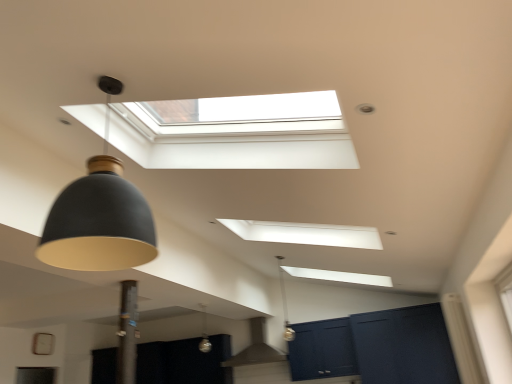
Question: Is point (397, 369) positioned closer to the camera than point (202, 326)?

Choices:
 (A) farther
 (B) closer

Answer: (B)

Question: Do you think matte dark blue cabinet at lower right is within satin silver glass at center, acting as the third lamp starting from the top, or outside of it?

Choices:
 (A) outside
 (B) inside

Answer: (A)

Question: Estimate the real-world distances between objects in this image. Which object is closer to the matte black pendant light at center, which is counted as the second lamp, starting from the top?

Choices:
 (A) matte gray exhaust hood at center
 (B) matte black lampshade at left, which is the second lamp in right-to-left order
 (C) satin silver glass at center, arranged as the third lamp when viewed from the front
 (D) matte dark blue cabinet at lower right
 (E) white matte window at right

Answer: (A)

Question: Which of these objects is positioned farthest from the white matte window at right?

Choices:
 (A) matte gray exhaust hood at center
 (B) matte dark blue cabinet at lower right
 (C) matte black pendant light at center, which is the 2th lamp in bottom-to-top order
 (D) satin silver glass at center, acting as the third lamp starting from the top
 (E) matte black lampshade at left, positioned as the first lamp in top-to-bottom order

Answer: (D)